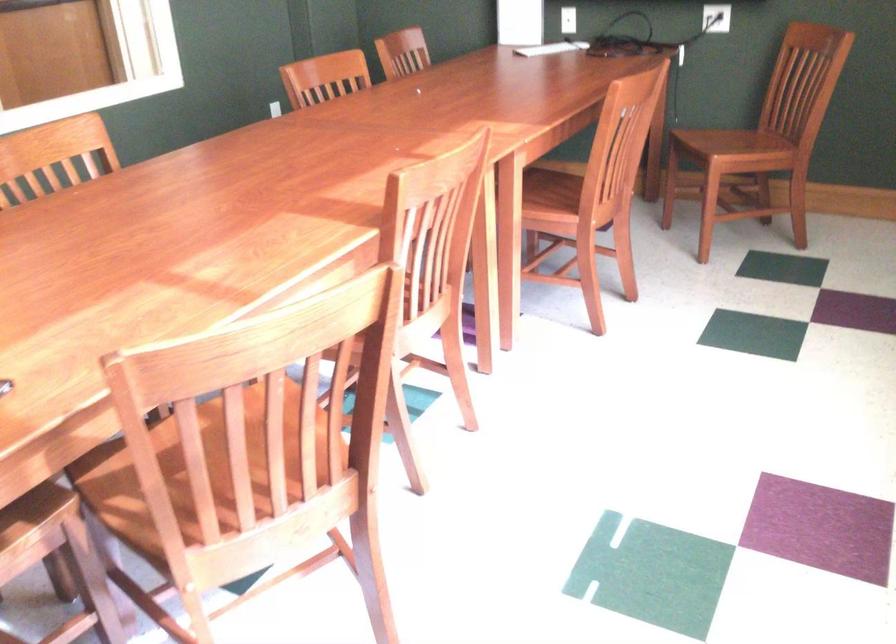
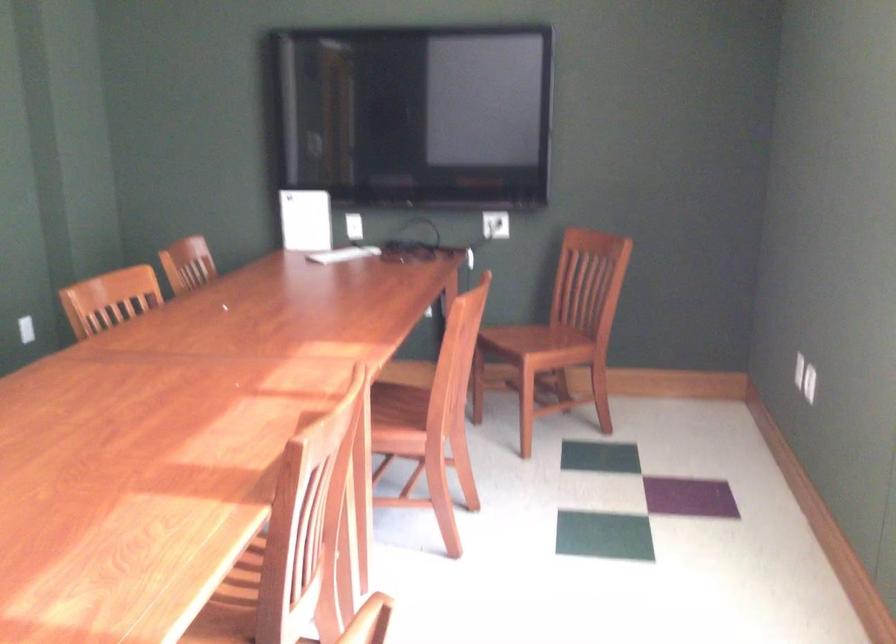
Question: How did the camera likely rotate?

Choices:
 (A) Left
 (B) Right
 (C) Up
 (D) Down

Answer: (B)